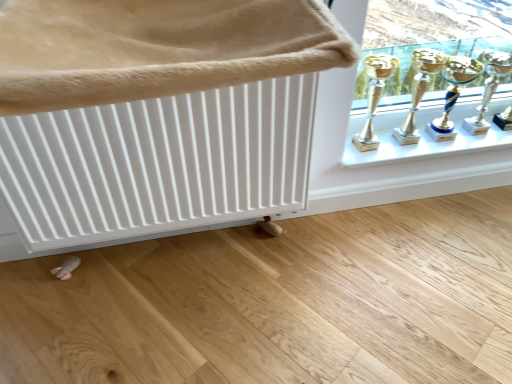
Question: From the image's perspective, does gold metallic trophy at upper right, which ranks as the second candle holder in right-to-left order, appear lower than silver metallic trophy at upper right, acting as the 2th candle holder starting from the left?

Choices:
 (A) yes
 (B) no

Answer: (A)

Question: Does gold metallic trophy at upper right, which is the 1th candle holder from left to right, have a lesser height compared to silver metallic trophy at upper right, the 1th candle holder when ordered from right to left?

Choices:
 (A) no
 (B) yes

Answer: (B)

Question: From the image's perspective, would you say gold metallic trophy at upper right, which ranks as the second candle holder in right-to-left order, is positioned over silver metallic trophy at upper right, acting as the 2th candle holder starting from the left?

Choices:
 (A) no
 (B) yes

Answer: (A)

Question: Is gold metallic trophy at upper right, which ranks as the second candle holder in right-to-left order, at the left side of silver metallic trophy at upper right, acting as the 2th candle holder starting from the left?

Choices:
 (A) no
 (B) yes

Answer: (B)

Question: Is gold metallic trophy at upper right, which ranks as the second candle holder in right-to-left order, positioned beyond the bounds of silver metallic trophy at upper right, acting as the 2th candle holder starting from the left?

Choices:
 (A) no
 (B) yes

Answer: (B)

Question: Can you confirm if gold metallic trophy at upper right, which is the 1th candle holder from left to right, is smaller than silver metallic trophy at upper right, the 1th candle holder when ordered from right to left?

Choices:
 (A) yes
 (B) no

Answer: (B)

Question: Would you consider white textured radiator at upper left to be distant from gold metallic trophy at upper right, which is the 1th candle holder from left to right?

Choices:
 (A) yes
 (B) no

Answer: (B)

Question: Could you tell me if white textured radiator at upper left is turned towards gold metallic trophy at upper right, which ranks as the second candle holder in right-to-left order?

Choices:
 (A) no
 (B) yes

Answer: (A)

Question: Is gold metallic trophy at upper right, which is the 1th candle holder from left to right, a part of white textured radiator at upper left?

Choices:
 (A) no
 (B) yes

Answer: (A)

Question: Can you confirm if white textured radiator at upper left is wider than gold metallic trophy at upper right, which is the 1th candle holder from left to right?

Choices:
 (A) no
 (B) yes

Answer: (B)

Question: Can you confirm if white textured radiator at upper left is taller than gold metallic trophy at upper right, which ranks as the second candle holder in right-to-left order?

Choices:
 (A) no
 (B) yes

Answer: (A)

Question: Is white textured radiator at upper left at the left side of gold metallic trophy at upper right, which ranks as the second candle holder in right-to-left order?

Choices:
 (A) yes
 (B) no

Answer: (A)

Question: Is silver metallic trophy at upper right, acting as the 2th candle holder starting from the left, outside of white textured radiator at upper left?

Choices:
 (A) no
 (B) yes

Answer: (B)